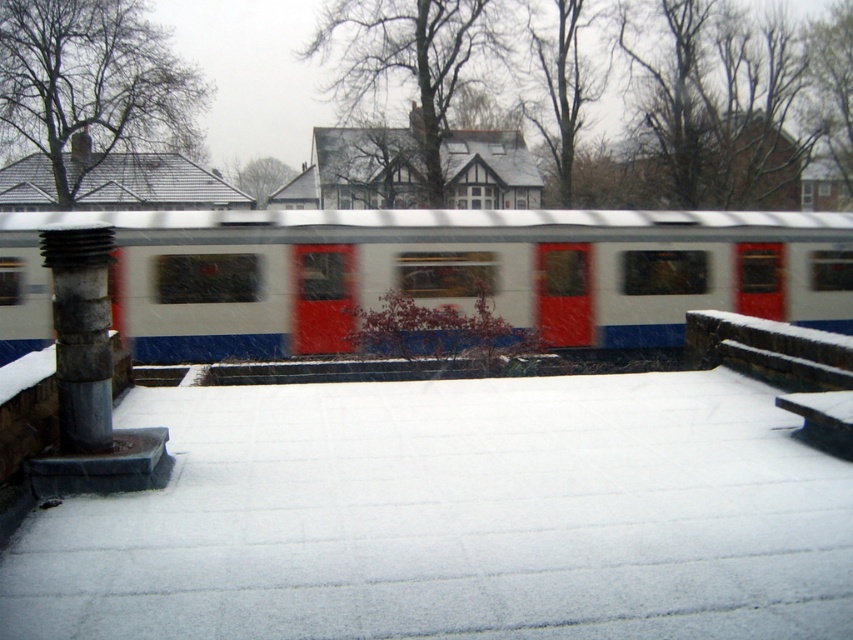
Is white glossy train at center thinner than rusty metallic column at left?

In fact, white glossy train at center might be wider than rusty metallic column at left.

Is point (432, 236) positioned after point (103, 308)?

Yes, point (432, 236) is behind point (103, 308).

Find the location of `white glossy train at center`. white glossy train at center is located at coordinates (432, 275).